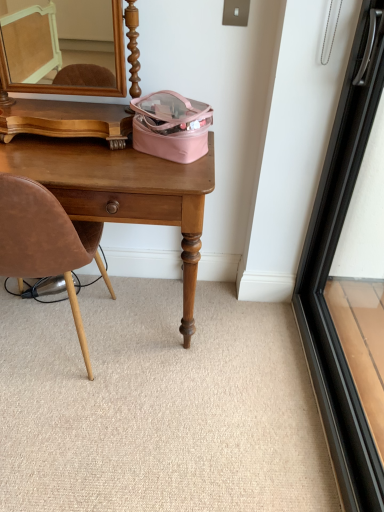
This screenshot has height=512, width=384. I want to click on free point in front of brown leather chair at left, so click(x=64, y=440).